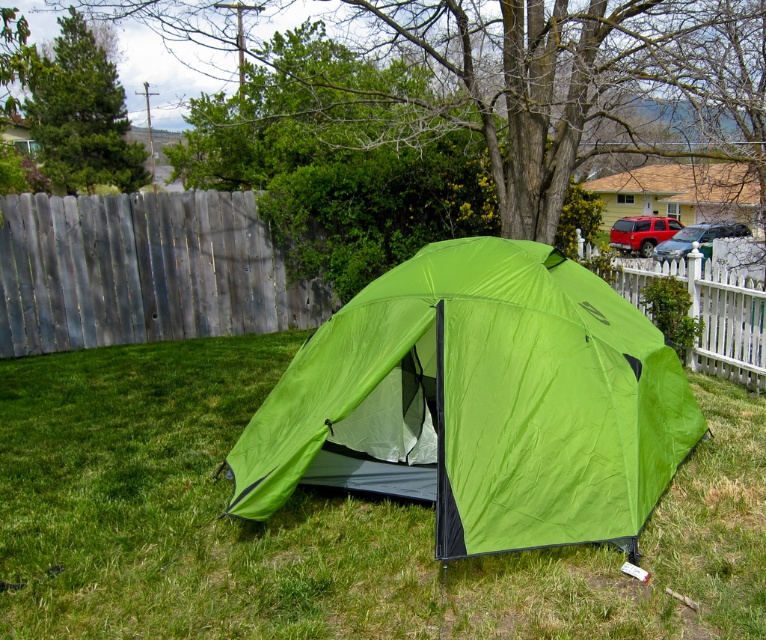
Can you confirm if green grass at center is smaller than white picket fence at right?

Yes, green grass at center is smaller than white picket fence at right.

At what (x,y) coordinates should I click in order to perform the action: click on green grass at center. Please return your answer as a coordinate pair (x, y). This screenshot has width=766, height=640. Looking at the image, I should click on (185, 508).

Does lime green fabric tent at center have a lesser height compared to white picket fence at right?

In fact, lime green fabric tent at center may be taller than white picket fence at right.

Identify the location of lime green fabric tent at center. (480, 403).

Does weathered wood fence at left appear under white picket fence at right?

Actually, weathered wood fence at left is above white picket fence at right.

Identify the location of weathered wood fence at left. This screenshot has height=640, width=766. click(142, 269).